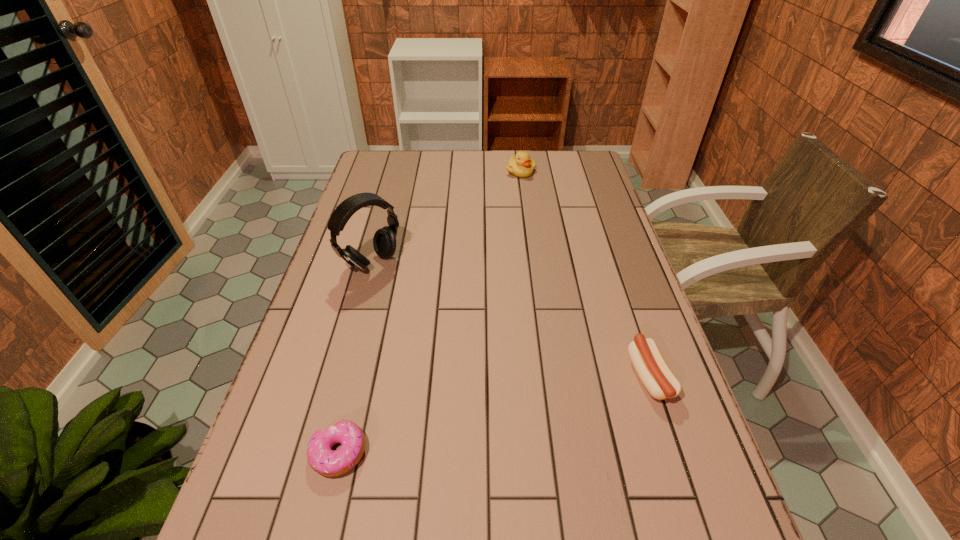
Find the location of a particular element. The height and width of the screenshot is (540, 960). free space on the desktop that is between the shortest object and the sausage and is positioned on the ear cups of the third nearest object is located at coordinates click(x=539, y=403).

This screenshot has height=540, width=960. Find the location of `vacant space on the desktop that is between the doughnut and the second nearest object and is positioned on the front-facing side of the third shortest object`. vacant space on the desktop that is between the doughnut and the second nearest object and is positioned on the front-facing side of the third shortest object is located at coordinates (510, 410).